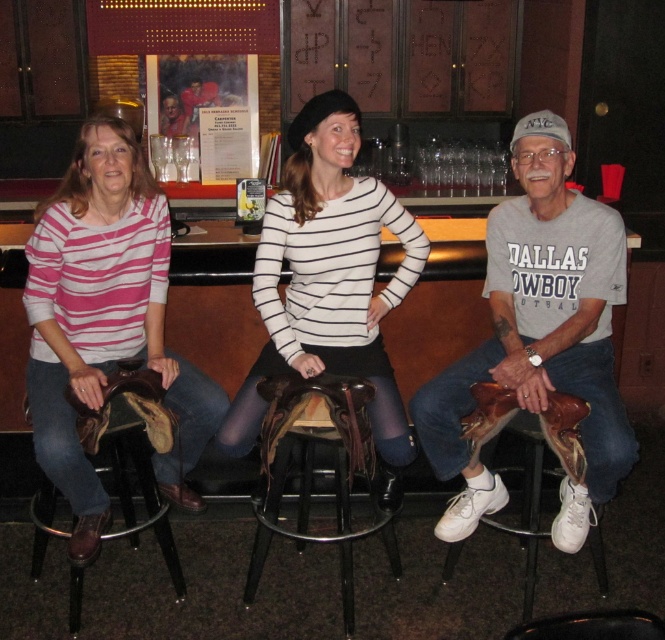
Is brown leather saddle at center closer to camera compared to brown leather saddle at left?

Yes.

Does point (289, 387) lie in front of point (154, 522)?

Yes, it is.

Locate an element on the screen. brown leather saddle at center is located at coordinates (313, 472).

Is the position of matte brown leather saddle at right more distant than that of brown leather saddle at center?

Yes, matte brown leather saddle at right is further from the viewer.

Is matte brown leather saddle at right closer to the viewer compared to brown leather saddle at center?

That is False.

Identify the location of matte brown leather saddle at right. (539, 336).

Is matte brown leather saddle at right smaller than matte brown leather saddle at left?

Incorrect, matte brown leather saddle at right is not smaller in size than matte brown leather saddle at left.

Who is taller, matte brown leather saddle at right or matte brown leather saddle at left?

With more height is matte brown leather saddle at right.

The width and height of the screenshot is (665, 640). Identify the location of matte brown leather saddle at right. (539, 336).

At what (x,y) coordinates should I click in order to perform the action: click on matte brown leather saddle at right. Please return your answer as a coordinate pair (x, y). Looking at the image, I should click on (539, 336).